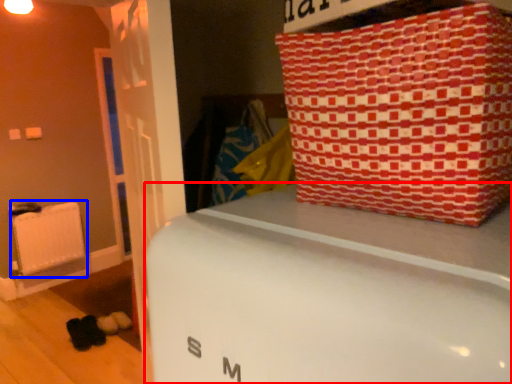
Question: Which object appears closest to the camera in this image, furniture (highlighted by a red box) or radiator (highlighted by a blue box)?

Choices:
 (A) furniture
 (B) radiator

Answer: (A)